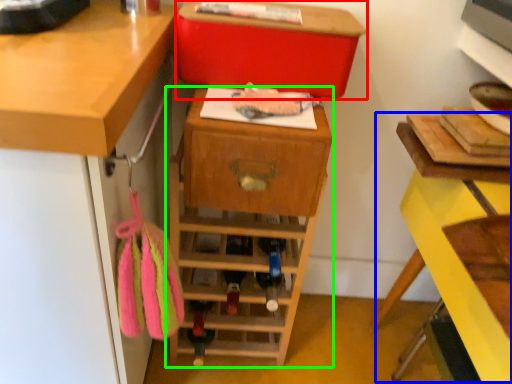
Question: Which object is positioned farthest from storage box (highlighted by a red box)? Select from computer desk (highlighted by a blue box) and shelf (highlighted by a green box).

Choices:
 (A) computer desk
 (B) shelf

Answer: (A)